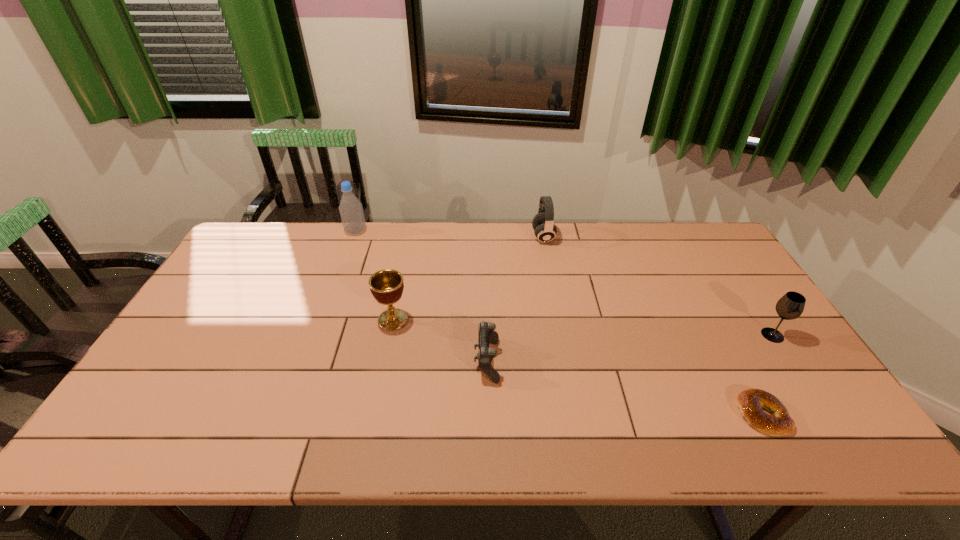
Locate which object is the third closest to the control. Please provide its 2D coordinates. Your answer should be formatted as a tuple, i.e. [(x, y)], where the tuple contains the x and y coordinates of a point satisfying the conditions above.

[(751, 402)]

Locate which object is the fourth closest to the bottle. Please provide its 2D coordinates. Your answer should be formatted as a tuple, i.e. [(x, y)], where the tuple contains the x and y coordinates of a point satisfying the conditions above.

[(751, 402)]

In order to click on vacant space that satisfies the following two spatial constraints: 1. on the surface of the control with buttons; 2. on the back side of the bagel in this screenshot , I will do `click(488, 415)`.

At what (x,y) coordinates should I click in order to perform the action: click on vacant space that satisfies the following two spatial constraints: 1. on the back side of the bagel; 2. on the surface of the second shortest object with buttons. Please return your answer as a coordinate pair (x, y). The image size is (960, 540). Looking at the image, I should click on (733, 361).

Where is `free space that satisfies the following two spatial constraints: 1. on the surface of the second shortest object with buttons; 2. on the right side of the second object from right to left`? The width and height of the screenshot is (960, 540). free space that satisfies the following two spatial constraints: 1. on the surface of the second shortest object with buttons; 2. on the right side of the second object from right to left is located at coordinates (488, 415).

Where is `vacant space that satisfies the following two spatial constraints: 1. on the ear cups of the wineglass; 2. on the left side of the headset`? The image size is (960, 540). vacant space that satisfies the following two spatial constraints: 1. on the ear cups of the wineglass; 2. on the left side of the headset is located at coordinates tap(562, 335).

Where is `vacant space that satisfies the following two spatial constraints: 1. on the ear cups of the headset; 2. on the left side of the rightmost object`? vacant space that satisfies the following two spatial constraints: 1. on the ear cups of the headset; 2. on the left side of the rightmost object is located at coordinates (562, 335).

You are a GUI agent. You are given a task and a screenshot of the screen. Output one action in this format:
    pyautogui.click(x=<x>, y=<y>)
    Task: Click on the vacant space that satisfies the following two spatial constraints: 1. on the front side of the tallest object; 2. on the left side of the bagel
    
    Given the screenshot: What is the action you would take?
    pyautogui.click(x=288, y=415)